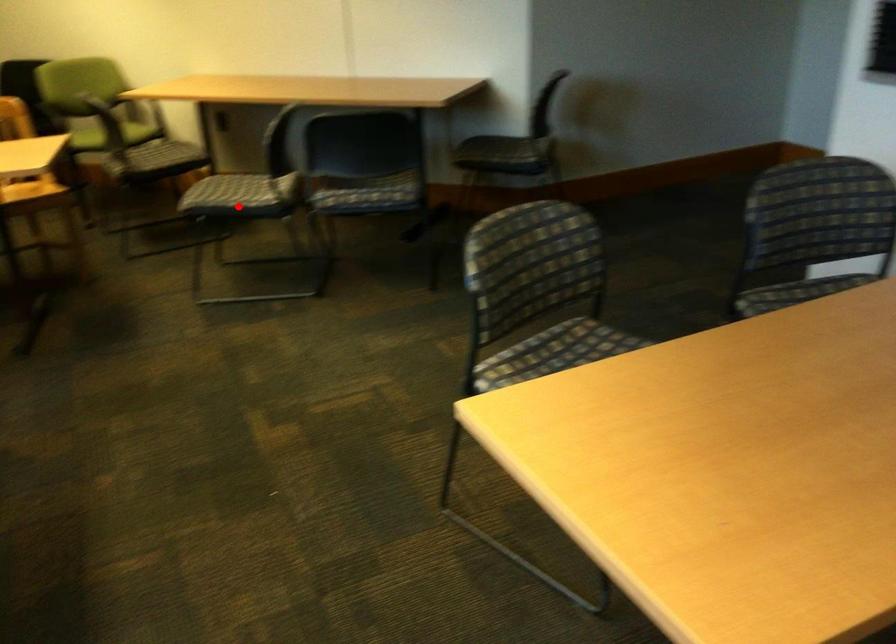
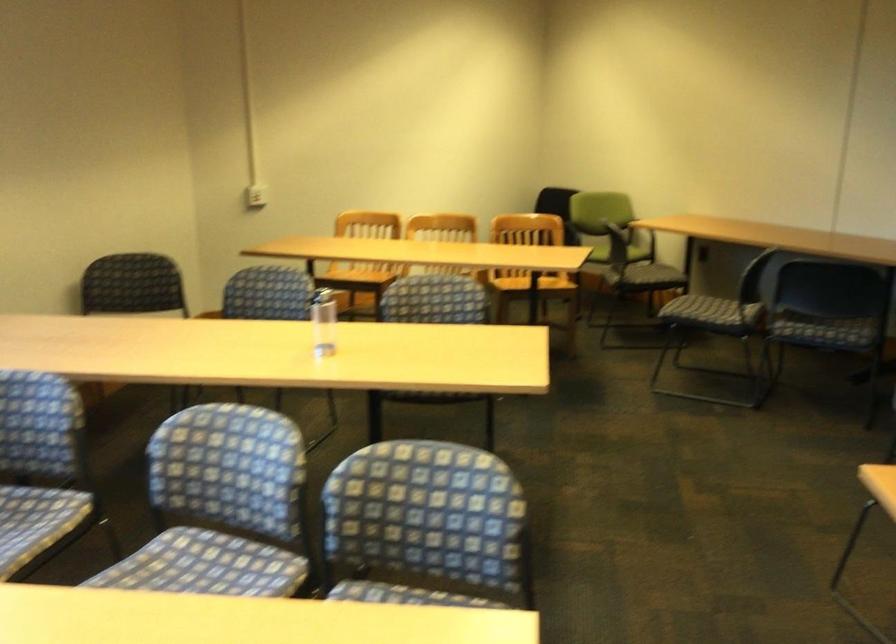
Where in the second image is the point corresponding to the highlighted location from the first image?

(710, 310)